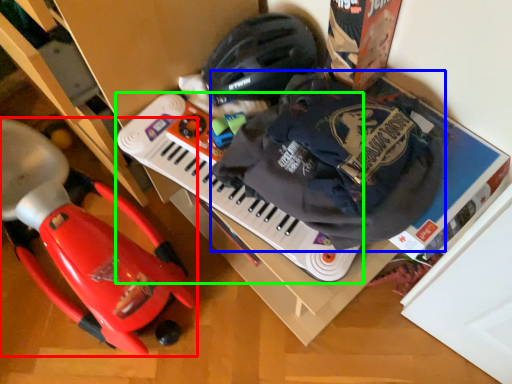
Question: Estimate the real-world distances between objects in this image. Which object is closer to toy (highlighted by a red box), waste (highlighted by a blue box) or musical keyboard (highlighted by a green box)?

Choices:
 (A) waste
 (B) musical keyboard

Answer: (B)